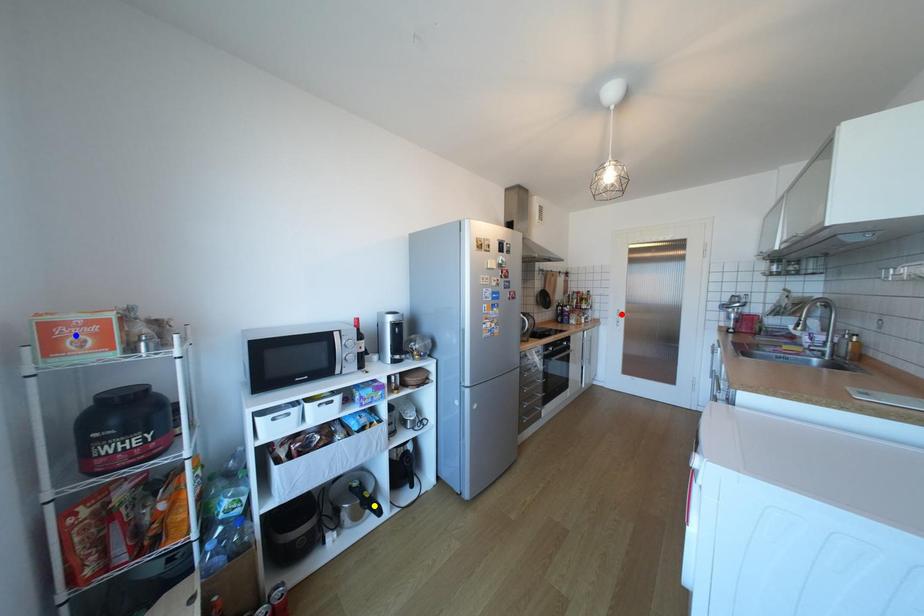
Order these from nearest to farthest:
- red point
- blue point
- yellow point

red point < yellow point < blue point